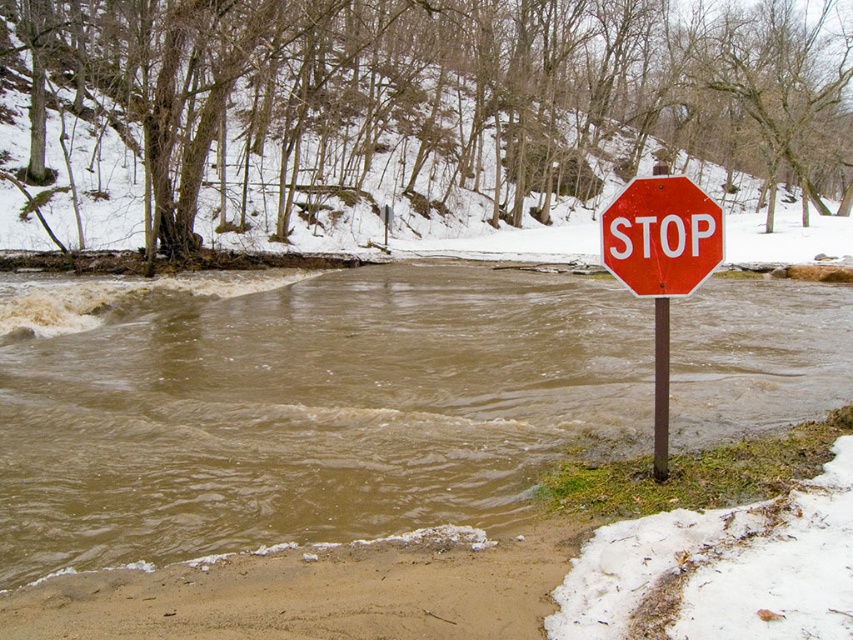
Question: Does brown muddy water at lower left appear under red glossy stop sign at right?

Choices:
 (A) no
 (B) yes

Answer: (A)

Question: Can you confirm if brown muddy water at lower left is bigger than red glossy stop sign at right?

Choices:
 (A) yes
 (B) no

Answer: (A)

Question: Which point is closer to the camera taking this photo?

Choices:
 (A) (543, 385)
 (B) (676, 284)

Answer: (B)

Question: Does brown muddy water at lower left lie behind red glossy stop sign at right?

Choices:
 (A) yes
 (B) no

Answer: (B)